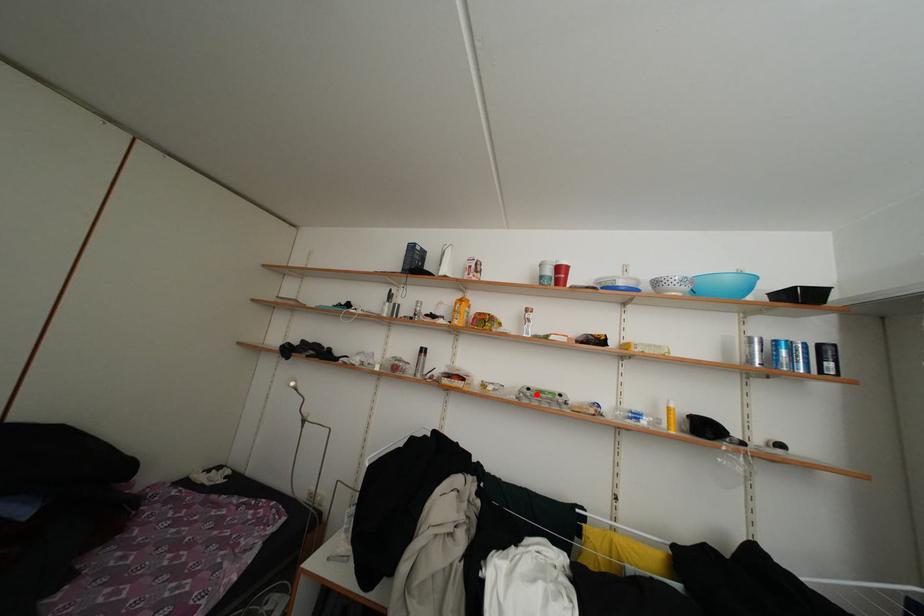
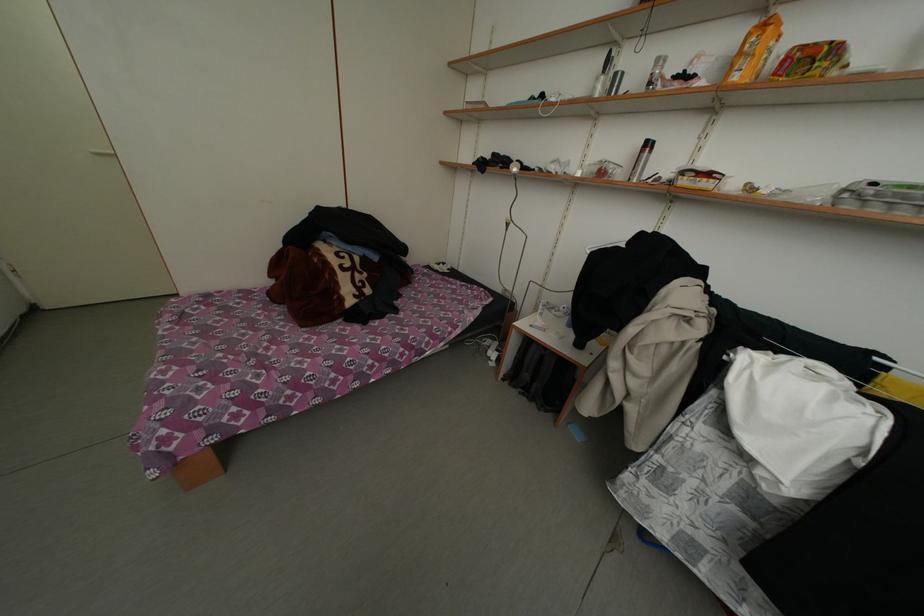
Question: I am providing you with two images of the same scene from different viewpoints. A red point is marked on the first image. Is the red point's position out of view in image 2?

Choices:
 (A) Yes
 (B) No

Answer: (B)